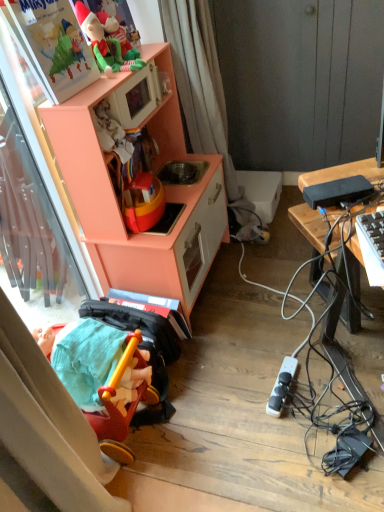
You are a GUI agent. You are given a task and a screenshot of the screen. Output one action in this format:
    pyautogui.click(x=<x>, y=<y>)
    Task: Click on the free space between white fabric curtain at upper center and black plastic power strip at lower right, acting as the 2th appliance starting from the top
    This screenshot has height=512, width=384.
    Given the screenshot: What is the action you would take?
    pyautogui.click(x=248, y=307)